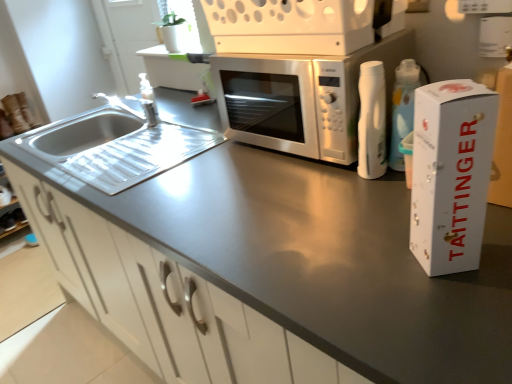
Image resolution: width=512 pixels, height=384 pixels. What are the coordinates of `vacant space behind white cardboard box at right` in the screenshot? It's located at (376, 214).